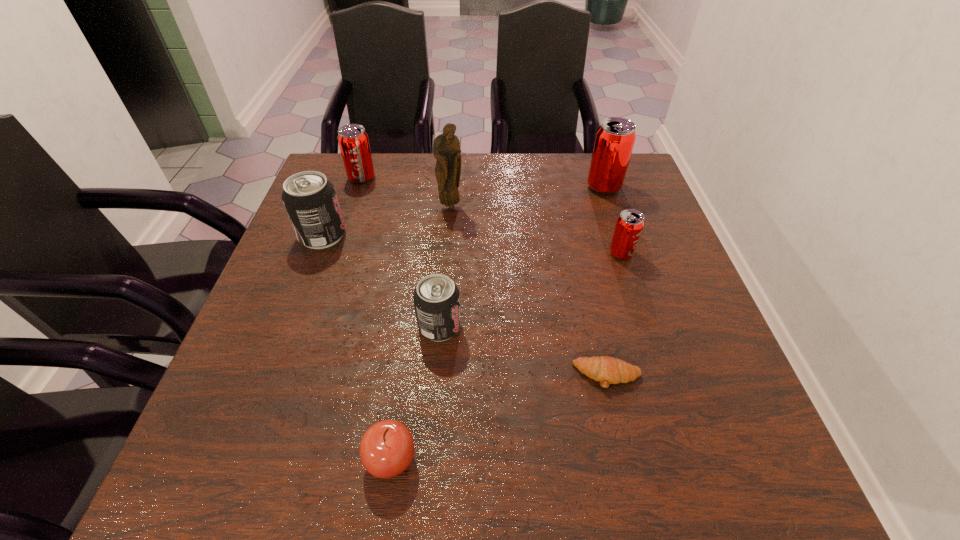
Locate an element on the screen. The width and height of the screenshot is (960, 540). free region at the far right corner of the desktop is located at coordinates (622, 191).

Identify the location of free space between the nearer black soda can and the nearest red soda can. This screenshot has width=960, height=540. (530, 290).

Where is `free space between the nearest red soda can and the sixth nearest object`? This screenshot has height=540, width=960. free space between the nearest red soda can and the sixth nearest object is located at coordinates (536, 230).

You are a GUI agent. You are given a task and a screenshot of the screen. Output one action in this format:
    pyautogui.click(x=<x>, y=<y>)
    Task: Click on the vacant region between the right black soda can and the second biggest red soda can
    The image size is (960, 540).
    Given the screenshot: What is the action you would take?
    pyautogui.click(x=400, y=252)

I want to click on vacant area that lies between the nearest object and the bigger black soda can, so click(x=356, y=347).

You are a GUI agent. You are given a task and a screenshot of the screen. Output one action in this format:
    pyautogui.click(x=<x>, y=<y>)
    Task: Click on the vacant point located between the leftmost red soda can and the seventh farthest object
    The image size is (960, 540).
    Given the screenshot: What is the action you would take?
    pyautogui.click(x=485, y=276)

Where is `free space between the apple and the smallest red soda can`? This screenshot has height=540, width=960. free space between the apple and the smallest red soda can is located at coordinates (506, 356).

This screenshot has width=960, height=540. In order to click on vacant space in between the nearest object and the second tallest object in this screenshot , I will do `click(497, 323)`.

In order to click on vacant point located between the tallest object and the second nearest object in this screenshot , I will do `click(529, 291)`.

Where is `vacant space that is in between the second biggest red soda can and the nearest soda can`? This screenshot has width=960, height=540. vacant space that is in between the second biggest red soda can and the nearest soda can is located at coordinates (400, 252).